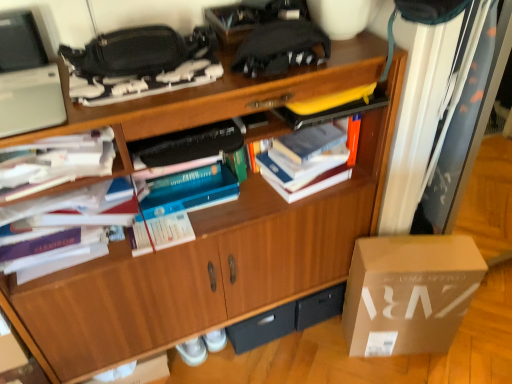
Question: Considering the relative sizes of wooden cabinet at center and white paper at left, which is the 1th book from left to right, in the image provided, is wooden cabinet at center shorter than white paper at left, which is the 1th book from left to right,?

Choices:
 (A) yes
 (B) no

Answer: (B)

Question: Could you tell me if wooden cabinet at center is turned towards white paper at left, which appears as the third book when viewed from the right?

Choices:
 (A) yes
 (B) no

Answer: (A)

Question: Does wooden cabinet at center appear on the right side of white paper at left, which is the 1th book from left to right?

Choices:
 (A) yes
 (B) no

Answer: (A)

Question: Is wooden cabinet at center smaller than white paper at left, which appears as the third book when viewed from the right?

Choices:
 (A) yes
 (B) no

Answer: (B)

Question: Does wooden cabinet at center come in front of white paper at left, which appears as the third book when viewed from the right?

Choices:
 (A) yes
 (B) no

Answer: (A)

Question: Is wooden cabinet at center bigger than white paper at left, which is the 1th book from left to right?

Choices:
 (A) yes
 (B) no

Answer: (A)

Question: From a real-world perspective, does black plastic drawer at lower center stand above white paper at upper left, arranged as the 2th book when viewed from the left?

Choices:
 (A) no
 (B) yes

Answer: (A)

Question: Considering the relative sizes of black plastic drawer at lower center and white paper at upper left, arranged as the 2th book when viewed from the left, in the image provided, is black plastic drawer at lower center thinner than white paper at upper left, arranged as the 2th book when viewed from the left,?

Choices:
 (A) yes
 (B) no

Answer: (A)

Question: Would you say black plastic drawer at lower center is a long distance from white paper at upper left, arranged as the 2th book when viewed from the left?

Choices:
 (A) yes
 (B) no

Answer: (B)

Question: From the image's perspective, is black plastic drawer at lower center over white paper at upper left, arranged as the 2th book when viewed from the left?

Choices:
 (A) yes
 (B) no

Answer: (B)

Question: Is black plastic drawer at lower center to the right of white paper at upper left, arranged as the 2th book when viewed from the left, from the viewer's perspective?

Choices:
 (A) no
 (B) yes

Answer: (B)

Question: Is black plastic drawer at lower center oriented away from white paper at upper left, marked as the second book in a right-to-left arrangement?

Choices:
 (A) yes
 (B) no

Answer: (B)

Question: From the image's perspective, is white cardboard box at lower right over black plastic drawer at lower center?

Choices:
 (A) yes
 (B) no

Answer: (A)